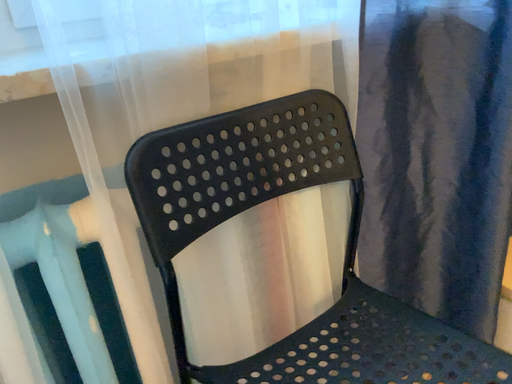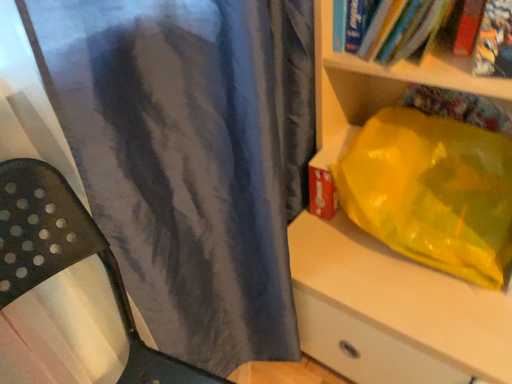
Question: How did the camera likely rotate when shooting the video?

Choices:
 (A) rotated upward
 (B) rotated downward

Answer: (B)